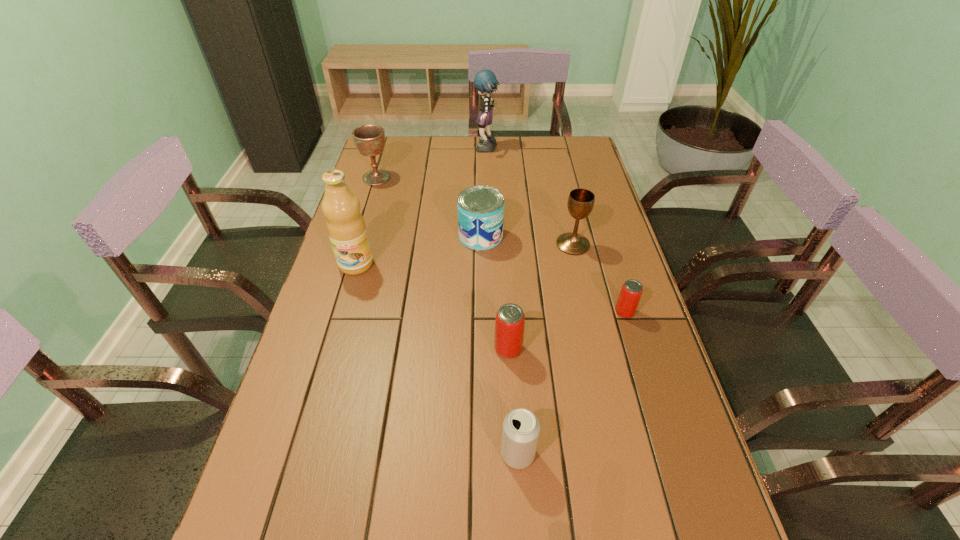
This screenshot has width=960, height=540. In order to click on blue rag doll in this screenshot , I will do `click(485, 81)`.

The image size is (960, 540). Find the location of `rag doll`. rag doll is located at coordinates (485, 81).

The height and width of the screenshot is (540, 960). Identify the location of olive oil. (346, 227).

Locate an element on the screen. Image resolution: width=960 pixels, height=540 pixels. the farther chalice is located at coordinates (369, 139).

Identify the location of the second farthest object. (369, 139).

This screenshot has height=540, width=960. I want to click on the nearer chalice, so click(x=580, y=204).

Locate an element on the screen. The height and width of the screenshot is (540, 960). the right chalice is located at coordinates (580, 204).

Locate an element on the screen. can is located at coordinates (480, 208).

You are a GUI agent. You are given a task and a screenshot of the screen. Output one action in this format:
    pyautogui.click(x=<x>, y=<y>)
    Task: Click on the bigger pink beer can
    The image size is (960, 540).
    Given the screenshot: What is the action you would take?
    [x=510, y=319]

Image resolution: width=960 pixels, height=540 pixels. Identify the location of the left pink beer can. (510, 319).